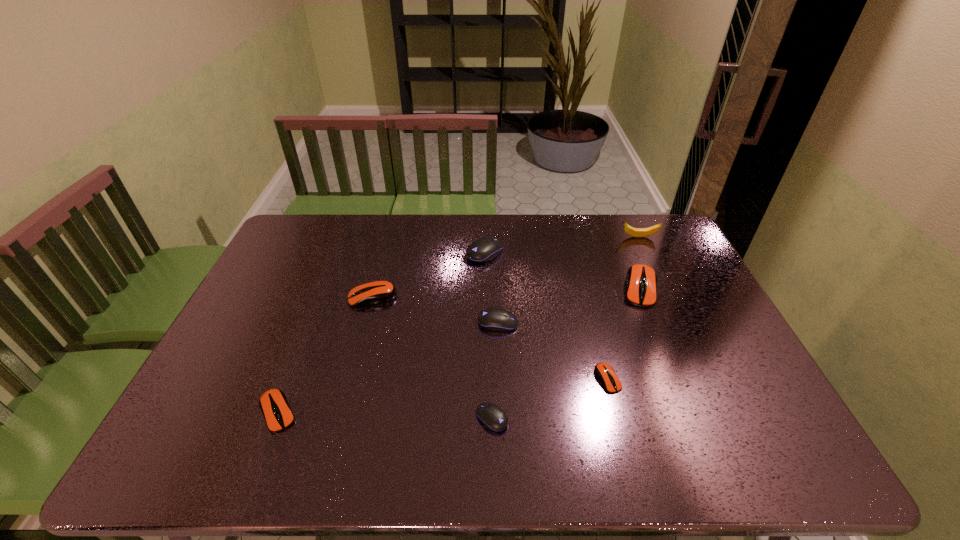
Identify the location of free location located 0.230m on the back of the second orange computer mouse from left to right. The width and height of the screenshot is (960, 540). (387, 244).

The image size is (960, 540). Identify the location of vacant space located 0.170m on the back of the second biggest black computer mouse. (496, 276).

Where is `vacant point located 0.080m on the back of the leftmost object`? The image size is (960, 540). vacant point located 0.080m on the back of the leftmost object is located at coordinates (296, 367).

Where is `vacant region located 0.350m on the right of the smallest black computer mouse`? The width and height of the screenshot is (960, 540). vacant region located 0.350m on the right of the smallest black computer mouse is located at coordinates (654, 418).

Locate an element on the screen. free location located on the left of the smallest orange computer mouse is located at coordinates (465, 379).

Locate an element on the screen. banana at the far edge is located at coordinates (635, 232).

Locate an element on the screen. The width and height of the screenshot is (960, 540). computer mouse situated at the far edge is located at coordinates (482, 250).

You are a GUI agent. You are given a task and a screenshot of the screen. Output one action in this format:
    pyautogui.click(x=<x>, y=<y>)
    Task: Click on the banana at the right edge
    The image size is (960, 540).
    Given the screenshot: What is the action you would take?
    pyautogui.click(x=635, y=232)

The width and height of the screenshot is (960, 540). In order to click on computer mouse located in the right edge section of the desktop in this screenshot , I will do `click(641, 280)`.

Identify the location of object situated at the far right corner. The image size is (960, 540). (635, 232).